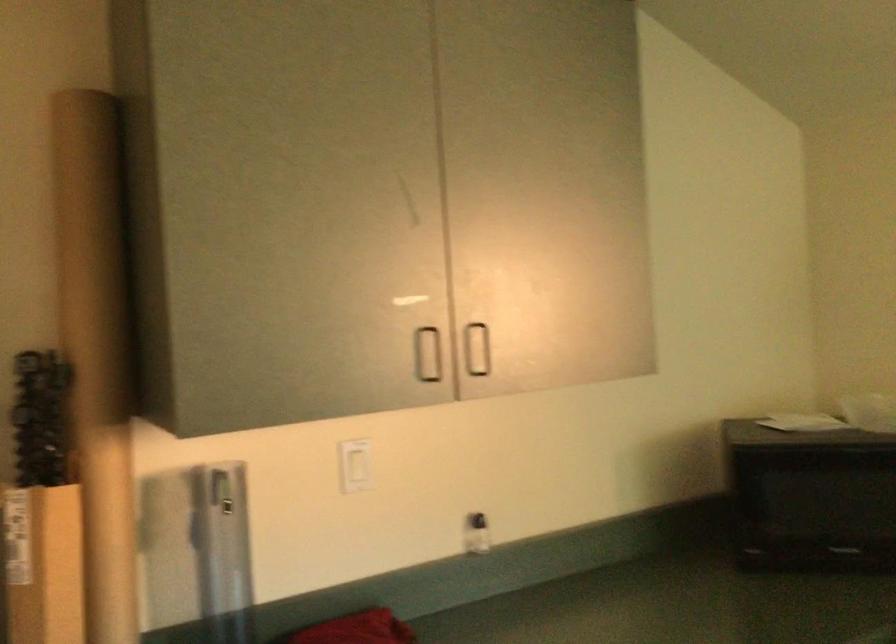
Question: The camera is either moving clockwise (left) or counter-clockwise (right) around the object. The first image is from the beginning of the video and the second image is from the end. Is the camera moving left or right when shooting the video?

Choices:
 (A) Left
 (B) Right

Answer: (B)